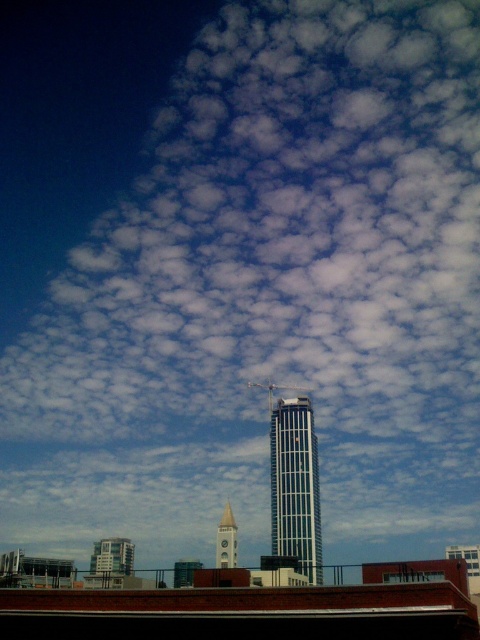
Question: Observing the image, what is the correct spatial positioning of silver metallic bell tower at center in reference to light gray stone bell tower at center?

Choices:
 (A) right
 (B) left

Answer: (A)

Question: Can you confirm if silver metallic bell tower at center is wider than light gray stone bell tower at center?

Choices:
 (A) yes
 (B) no

Answer: (A)

Question: Is silver metallic bell tower at center below light gray stone bell tower at center?

Choices:
 (A) no
 (B) yes

Answer: (A)

Question: Which point is closer to the camera?

Choices:
 (A) (x=225, y=544)
 (B) (x=280, y=426)

Answer: (A)

Question: Which object is closer to the camera taking this photo?

Choices:
 (A) silver metallic bell tower at center
 (B) light gray stone bell tower at center

Answer: (A)

Question: Among these points, which one is nearest to the camera?

Choices:
 (A) (285, 436)
 (B) (229, 560)

Answer: (B)